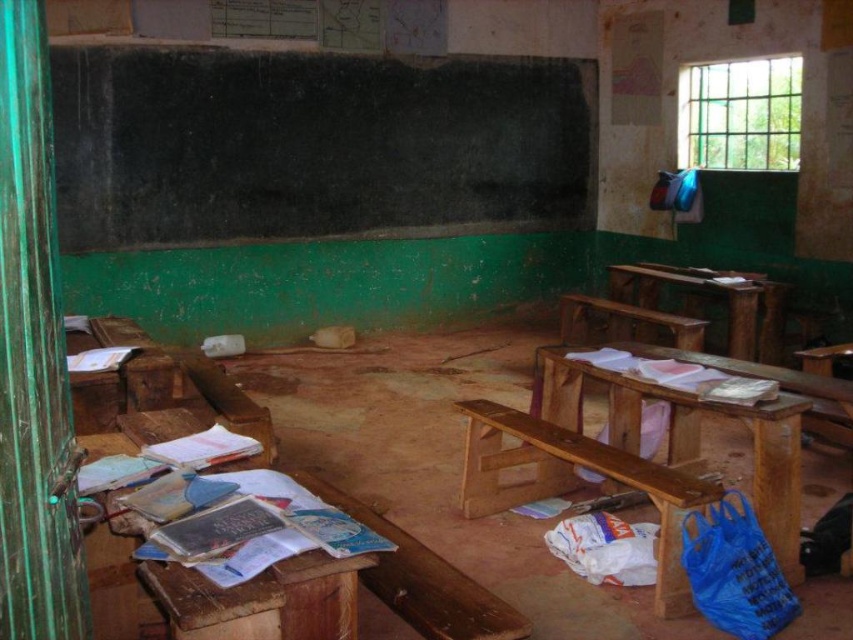
Question: Is wooden at left wider than brown wooden table at center?

Choices:
 (A) no
 (B) yes

Answer: (A)

Question: Which is farther from the wooden bench at right?

Choices:
 (A) brown wooden table at center
 (B) wooden bench at center
 (C) black chalkboard at upper center
 (D) wooden at left

Answer: (C)

Question: Does black chalkboard at upper center appear over wooden bench at center?

Choices:
 (A) yes
 (B) no

Answer: (A)

Question: Which point appears farthest from the camera in this image?

Choices:
 (A) (219, 596)
 (B) (717, 296)

Answer: (B)

Question: Which object is farther from the camera taking this photo?

Choices:
 (A) wooden at left
 (B) brown wooden table at center

Answer: (B)

Question: Is wooden bench at right to the right of brown wooden table at center from the viewer's perspective?

Choices:
 (A) no
 (B) yes

Answer: (A)